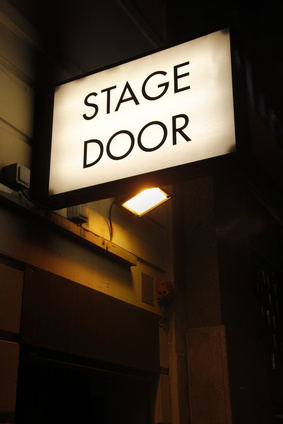
Find the location of `wooden plank`. wooden plank is located at coordinates (129, 256), (96, 243), (66, 235), (22, 206).